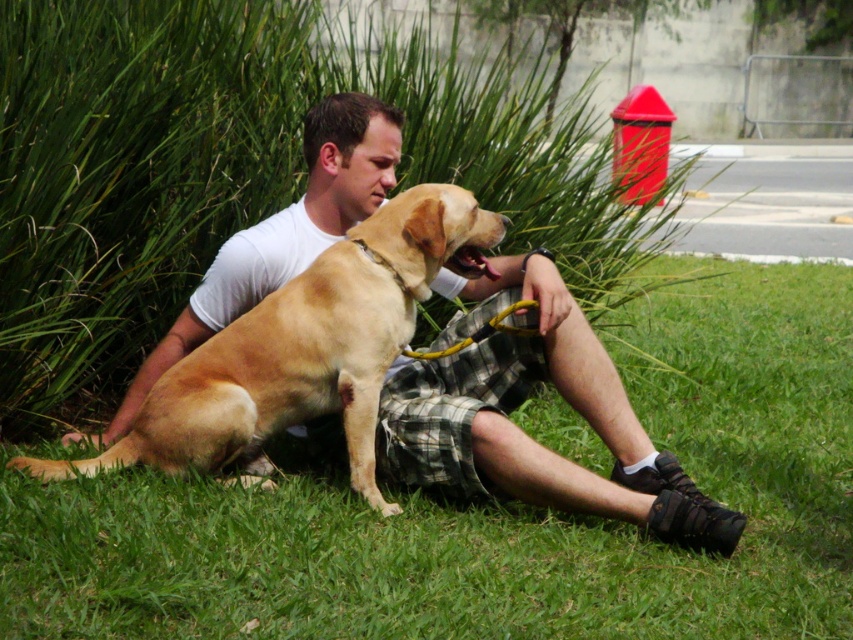
You are a photographer trying to capture the man in the white tshirt at center. The camera you are using has a focus point at coordinate [520,403]. Will this focus point help you capture the matte white tshirt at center?

Yes, the focus point at coordinate [520,403] is positioned exactly where the matte white tshirt at center is located, so it will help capture it.

You are a photographer wanting to capture the golden fur dog at center and the green grass at lower center in a single shot. Which object is closer to the camera?

The golden fur dog at center is closer to the camera than the green grass at lower center because the grass is shorter than the dog.